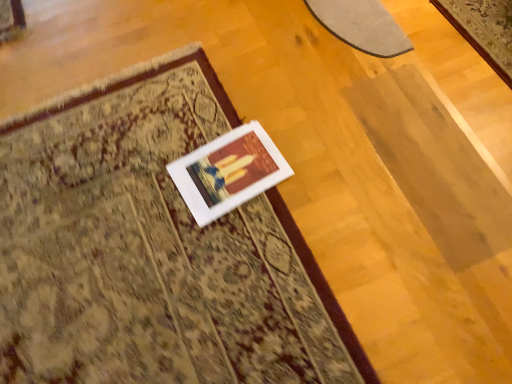
The width and height of the screenshot is (512, 384). Find the location of `vacant area on top of beige carpet at center, the 1th mat positioned from the bottom (from a real-world perspective)`. vacant area on top of beige carpet at center, the 1th mat positioned from the bottom (from a real-world perspective) is located at coordinates (131, 236).